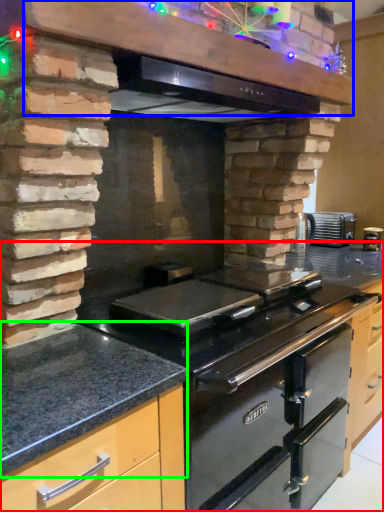
Question: Estimate the real-world distances between objects in this image. Which object is farther from countertop (highlighted by a red box), vent (highlighted by a blue box) or countertop (highlighted by a green box)?

Choices:
 (A) vent
 (B) countertop

Answer: (A)